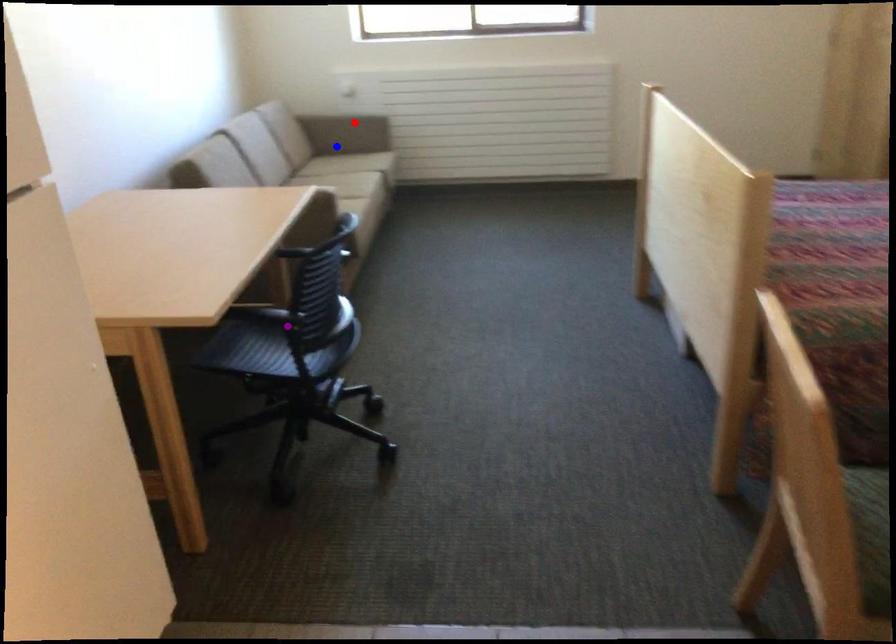
Looking at this image, order these from nearest to farthest:
purple point, red point, blue point

1. purple point
2. red point
3. blue point